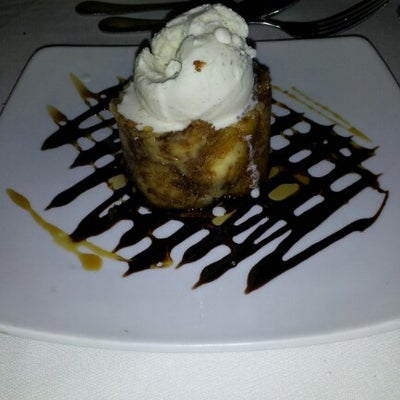
At what (x,y) coordinates should I click in order to perform the action: click on white square plate. Please return your answer as a coordinate pair (x, y). The height and width of the screenshot is (400, 400). Looking at the image, I should click on (52, 62).